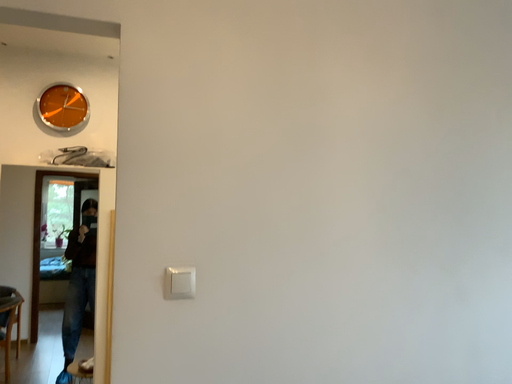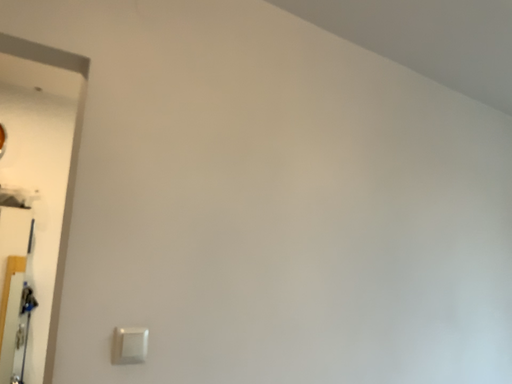
Question: Which way did the camera rotate in the video?

Choices:
 (A) rotated upward
 (B) rotated downward

Answer: (A)